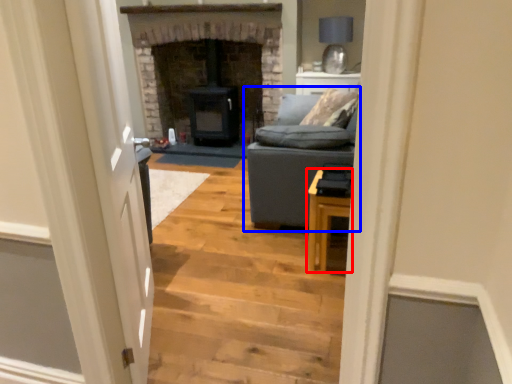
Question: Which of the following is the farthest to the observer, table (highlighted by a red box) or studio couch (highlighted by a blue box)?

Choices:
 (A) table
 (B) studio couch

Answer: (B)